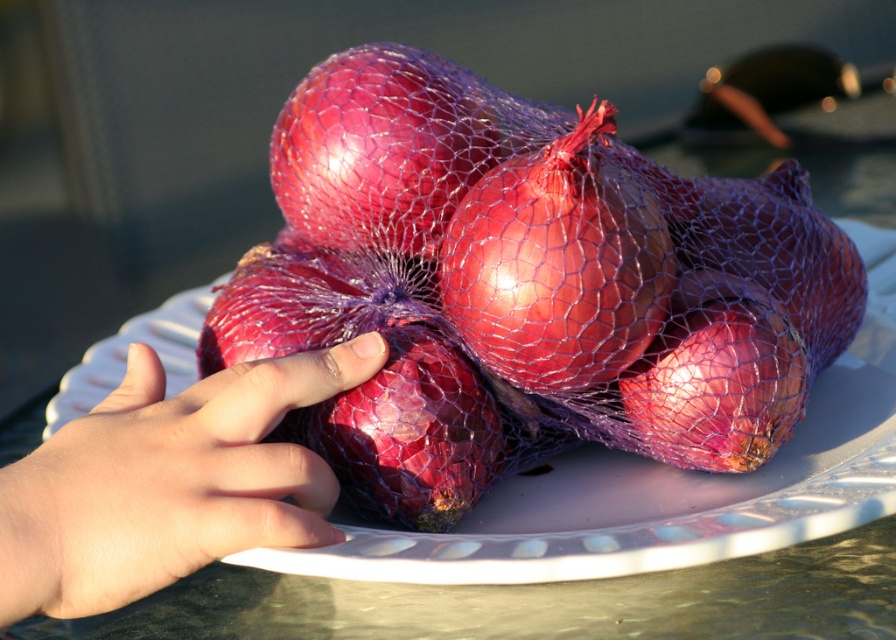
You are a chef trying to grab an onion from the glossy mesh onion at center. Your hand is at smooth skin hand at center. Can your hand reach the onion without moving your arm?

The distance of smooth skin hand at center from glossy mesh onion at center is 3.68 inches, so yes, the hand can reach the onion without moving the arm since the distance is within a comfortable reach.

You are trying to grab an onion from the bundle. There are two points marked on the image. The first point is at coordinate point [80,518] and the second point is at coordinate point [350,125]. Which point is closer to your hand?

Point [80,518] is in front of point [350,125], so the first point is closer to your hand.